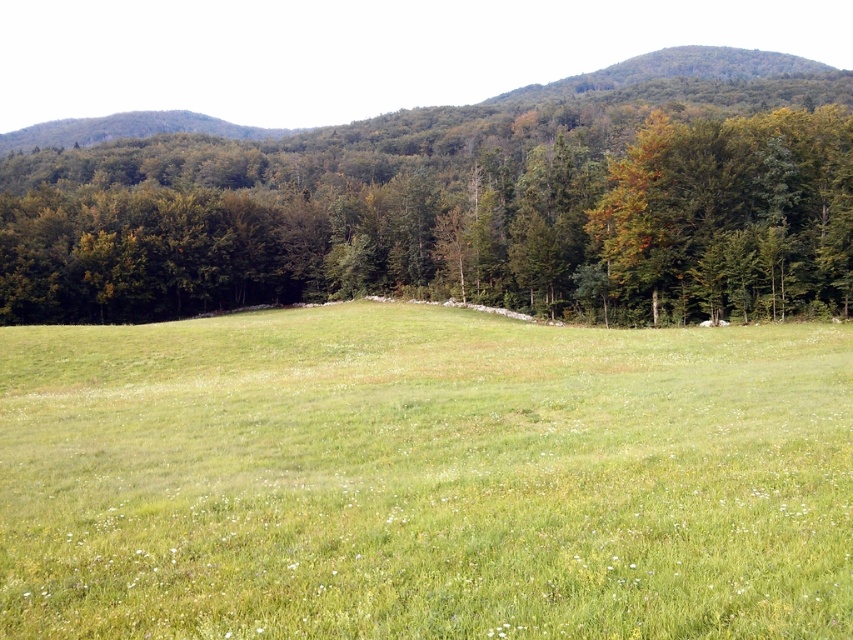
How far apart are green grassy field at center and green leafy tree at center?

104.70 meters

What do you see at coordinates (424, 477) in the screenshot? This screenshot has width=853, height=640. I see `green grassy field at center` at bounding box center [424, 477].

Does point (540, 416) come behind point (82, 285)?

That is False.

Locate an element on the screen. This screenshot has width=853, height=640. green grassy field at center is located at coordinates (424, 477).